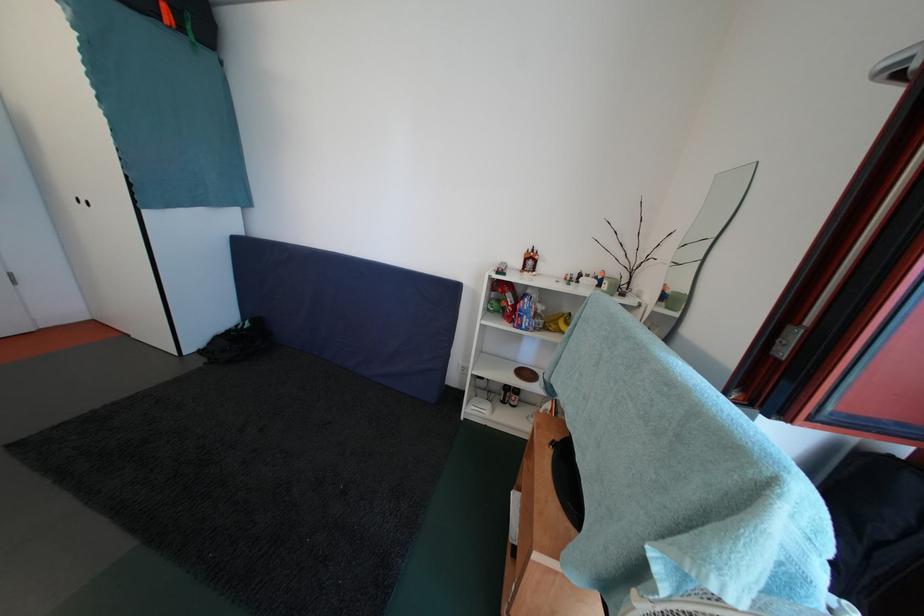
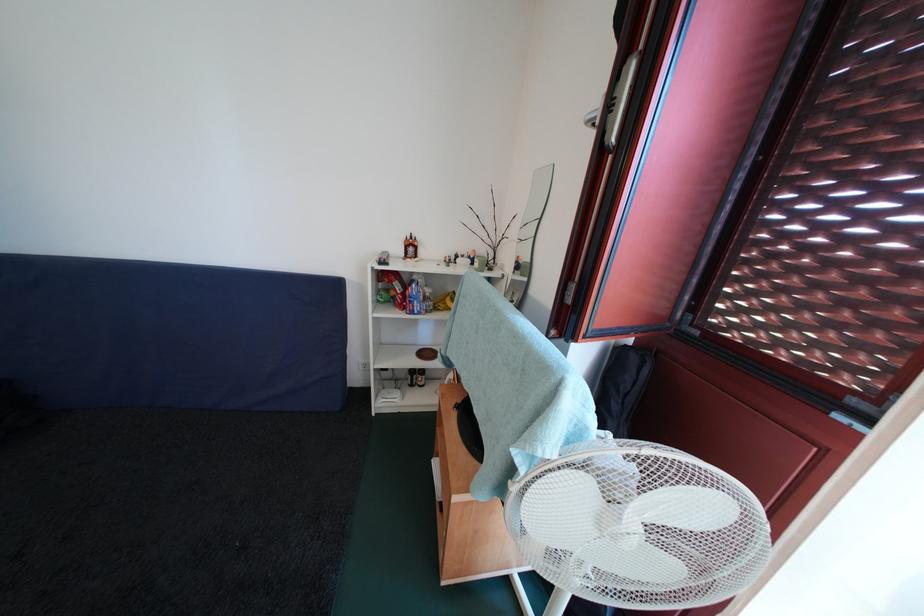
Where in the second image is the point corresponding to pixel 537 256 from the first image?

(416, 243)